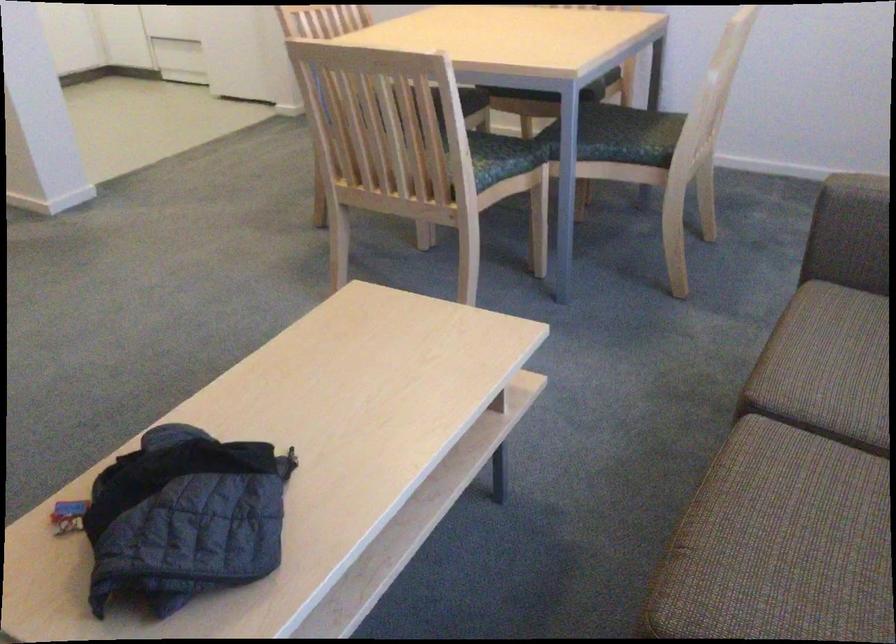
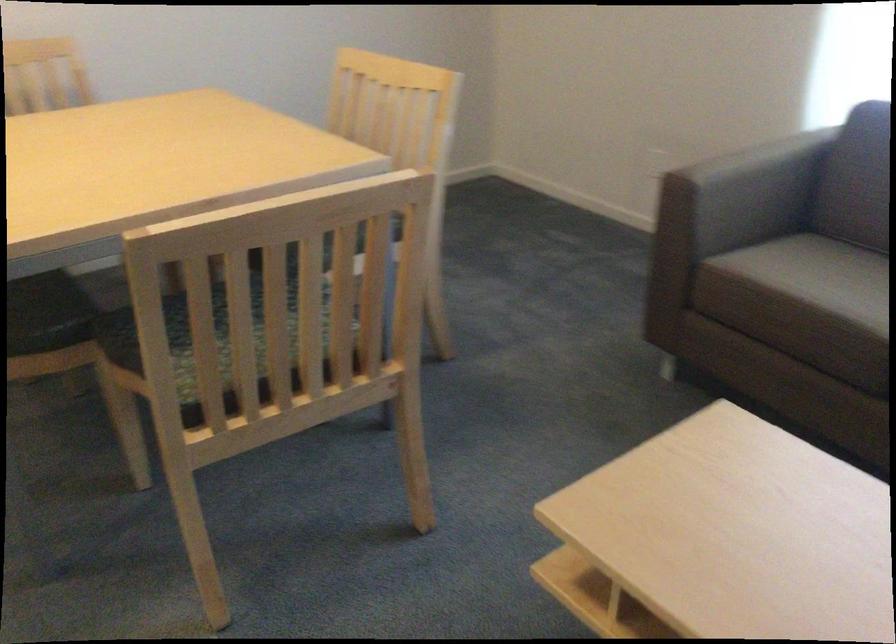
Question: I am providing you with two images of the same scene from different viewpoints. Which of the following objects are not visible in image2?

Choices:
 (A) brown sofa armrest
 (B) green chair sitting surface
 (C) small red-topped jar
 (D) chair sitting surface

Answer: (B)